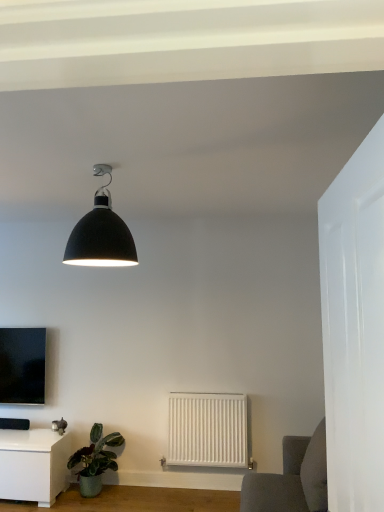
Question: Can you confirm if matte black lampshade at upper center is smaller than white matte radiator at center?

Choices:
 (A) no
 (B) yes

Answer: (A)

Question: Can you confirm if matte black lampshade at upper center is thinner than white matte radiator at center?

Choices:
 (A) yes
 (B) no

Answer: (B)

Question: Can you confirm if matte black lampshade at upper center is wider than white matte radiator at center?

Choices:
 (A) no
 (B) yes

Answer: (B)

Question: Can you confirm if matte black lampshade at upper center is positioned to the left of white matte radiator at center?

Choices:
 (A) no
 (B) yes

Answer: (B)

Question: From the image's perspective, is matte black lampshade at upper center on top of white matte radiator at center?

Choices:
 (A) yes
 (B) no

Answer: (A)

Question: Is matte black tv at left in front of or behind white matte radiator at center in the image?

Choices:
 (A) front
 (B) behind

Answer: (B)

Question: Considering the positions of matte black tv at left and white matte radiator at center in the image, is matte black tv at left bigger or smaller than white matte radiator at center?

Choices:
 (A) small
 (B) big

Answer: (A)

Question: In terms of width, does matte black tv at left look wider or thinner when compared to white matte radiator at center?

Choices:
 (A) wide
 (B) thin

Answer: (A)

Question: Is matte black tv at left spatially inside white matte radiator at center, or outside of it?

Choices:
 (A) outside
 (B) inside

Answer: (A)

Question: Is point (97, 218) closer or farther from the camera than point (67, 467)?

Choices:
 (A) closer
 (B) farther

Answer: (A)

Question: From the image's perspective, is matte black lampshade at upper center located above or below green matte plant at lower left?

Choices:
 (A) below
 (B) above

Answer: (B)

Question: From a real-world perspective, is matte black lampshade at upper center positioned above or below green matte plant at lower left?

Choices:
 (A) above
 (B) below

Answer: (A)

Question: In the image, is matte black lampshade at upper center positioned in front of or behind green matte plant at lower left?

Choices:
 (A) front
 (B) behind

Answer: (A)

Question: From the image's perspective, is white matte radiator at center located above or below white glossy door at right?

Choices:
 (A) above
 (B) below

Answer: (B)

Question: Is white matte radiator at center to the left or to the right of white glossy door at right in the image?

Choices:
 (A) right
 (B) left

Answer: (B)